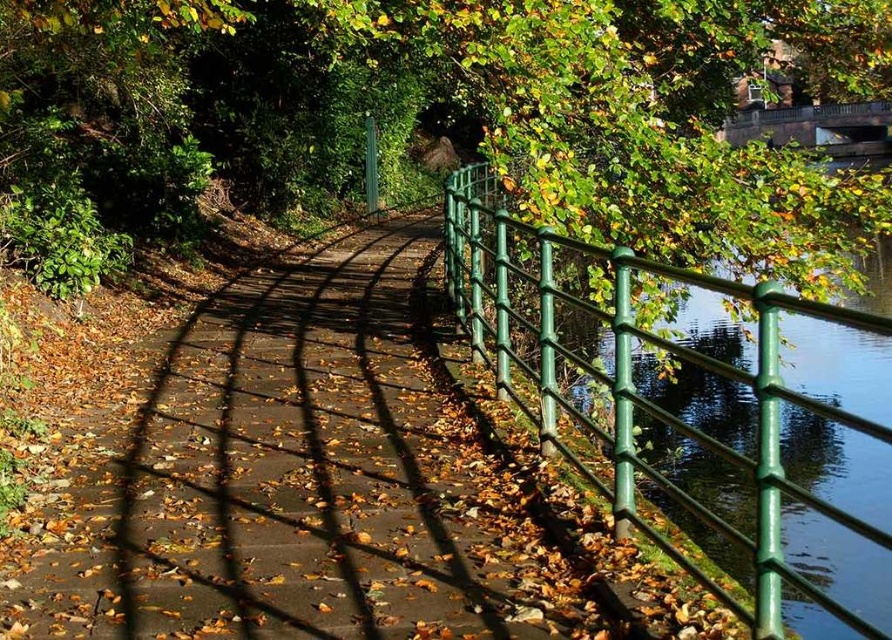
You are walking along the pathway and want to cross the dark gray stone bridge at upper right. To reach it, you must pass by the green metal fence at right. Which object will you encounter first?

You will encounter the green metal fence at right first because it is in front of the dark gray stone bridge at upper right.

You are a painter standing on the pathway and want to paint both the green metal fence at right and the dark gray stone bridge at upper right. Which object should you focus on first if you want to paint the wider one first?

The green metal fence at right is wider than the dark gray stone bridge at upper right, so you should focus on painting the green metal fence at right first.

You are walking along the pathway and want to cross the dark gray stone bridge at upper right. Which direction should you head relative to the green metal fence at right?

You should head to the right of the green metal fence at right to reach the dark gray stone bridge at upper right because the green metal fence at right is to the left of dark gray stone bridge at upper right.